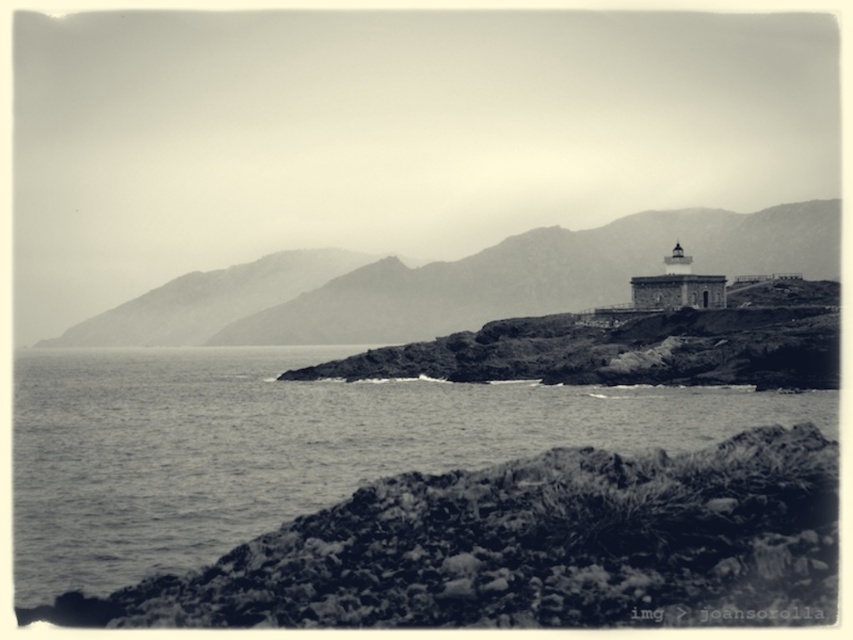
You are a kayaker planning to navigate between the smooth water at lower left and the rugged stone mountain at center. Given that your kayak requires a minimum of 50 meters of space to maneuver safely, can you safely navigate between these two landmarks?

The distance between the smooth water at lower left and the rugged stone mountain at center is 52.95 meters, which exceeds the required 50 meters for safe maneuvering. Therefore, you can safely navigate between these two landmarks.

You are a photographer standing at the point labeled point (151, 564). You want to take a photo of the lighthouse in the background. However, there is another point labeled point (540, 285) in your way. Will the lighthouse be visible in your photo if you aim directly at the lighthouse?

The point labeled point (151, 564) is in front of point labeled point (540, 285). Since you are standing at point (151, 564), the lighthouse will be visible in your photo because the point (540, 285) is behind you and not blocking the view.